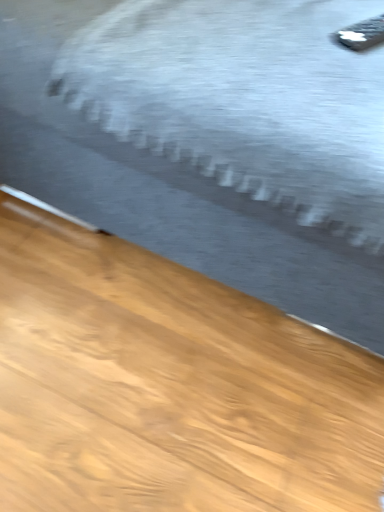
Locate an element on the screen. gray fabric bed at upper center is located at coordinates (211, 140).

The width and height of the screenshot is (384, 512). What do you see at coordinates (211, 140) in the screenshot? I see `gray fabric bed at upper center` at bounding box center [211, 140].

This screenshot has height=512, width=384. What do you see at coordinates (362, 34) in the screenshot?
I see `black plastic remote at upper right` at bounding box center [362, 34].

Where is `black plastic remote at upper right`? This screenshot has height=512, width=384. black plastic remote at upper right is located at coordinates (362, 34).

Where is `gray fabric bed at upper center`? This screenshot has height=512, width=384. gray fabric bed at upper center is located at coordinates (211, 140).

Between black plastic remote at upper right and gray fabric bed at upper center, which one appears on the left side from the viewer's perspective?

From the viewer's perspective, gray fabric bed at upper center appears more on the left side.

Who is more distant, black plastic remote at upper right or gray fabric bed at upper center?

black plastic remote at upper right is more distant.

Does point (336, 34) come in front of point (226, 133)?

No, (336, 34) is further to viewer.

From the image's perspective, is black plastic remote at upper right above gray fabric bed at upper center?

Incorrect, from the image's perspective, black plastic remote at upper right is lower than gray fabric bed at upper center.

From a real-world perspective, is black plastic remote at upper right on top of gray fabric bed at upper center?

Yes, from a real-world perspective, black plastic remote at upper right is over gray fabric bed at upper center

Considering the sizes of objects black plastic remote at upper right and gray fabric bed at upper center in the image provided, who is thinner, black plastic remote at upper right or gray fabric bed at upper center?

Thinner between the two is black plastic remote at upper right.

Between black plastic remote at upper right and gray fabric bed at upper center, which one has more height?

Standing taller between the two is gray fabric bed at upper center.

Considering the sizes of black plastic remote at upper right and gray fabric bed at upper center in the image, is black plastic remote at upper right bigger or smaller than gray fabric bed at upper center?

Clearly, black plastic remote at upper right is smaller in size than gray fabric bed at upper center.

Is black plastic remote at upper right completely or partially outside of gray fabric bed at upper center?

No.

Does black plastic remote at upper right touch gray fabric bed at upper center?

black plastic remote at upper right and gray fabric bed at upper center are clearly separated.

Does black plastic remote at upper right turn towards gray fabric bed at upper center?

Yes.

Locate an element on the screen. The width and height of the screenshot is (384, 512). bed that appears in front of the black plastic remote at upper right is located at coordinates (211, 140).

Considering the relative positions of gray fabric bed at upper center and black plastic remote at upper right in the image provided, is gray fabric bed at upper center to the right of black plastic remote at upper right from the viewer's perspective?

In fact, gray fabric bed at upper center is to the left of black plastic remote at upper right.

Considering the positions of objects gray fabric bed at upper center and black plastic remote at upper right in the image provided, who is in front, gray fabric bed at upper center or black plastic remote at upper right?

gray fabric bed at upper center is in front.

Does point (299, 167) lie in front of point (349, 48)?

Yes, it is in front of point (349, 48).

From the image's perspective, is gray fabric bed at upper center on top of black plastic remote at upper right?

Correct, gray fabric bed at upper center appears higher than black plastic remote at upper right in the image.

From a real-world perspective, who is located lower, gray fabric bed at upper center or black plastic remote at upper right?

gray fabric bed at upper center.

Between gray fabric bed at upper center and black plastic remote at upper right, which one has larger width?

gray fabric bed at upper center.

Looking at this image, who is shorter, gray fabric bed at upper center or black plastic remote at upper right?

With less height is black plastic remote at upper right.

Is gray fabric bed at upper center smaller than black plastic remote at upper right?

Incorrect, gray fabric bed at upper center is not smaller in size than black plastic remote at upper right.

Can black plastic remote at upper right be found inside gray fabric bed at upper center?

Yes, black plastic remote at upper right is a part of gray fabric bed at upper center.

Would you say gray fabric bed at upper center is a long distance from black plastic remote at upper right?

gray fabric bed at upper center is near black plastic remote at upper right, not far away.

Is gray fabric bed at upper center facing towards black plastic remote at upper right?

No.

How many degrees apart are the facing directions of gray fabric bed at upper center and black plastic remote at upper right?

They differ by 66.2 degrees in their facing directions.

Where is `bed on the left of black plastic remote at upper right`? The height and width of the screenshot is (512, 384). bed on the left of black plastic remote at upper right is located at coordinates (211, 140).

Image resolution: width=384 pixels, height=512 pixels. Identify the location of bed above the black plastic remote at upper right (from the image's perspective). (211, 140).

This screenshot has height=512, width=384. I want to click on bed in front of the black plastic remote at upper right, so click(x=211, y=140).